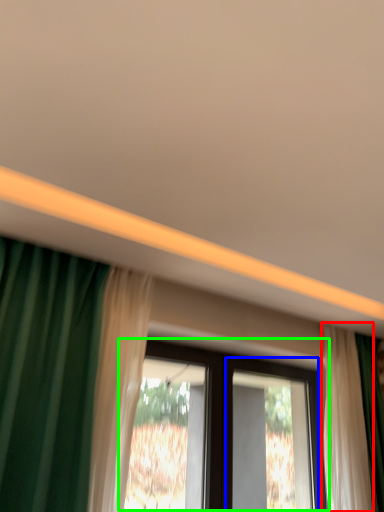
Question: Which is farther away from curtain (highlighted by a red box)? screen door (highlighted by a blue box) or window (highlighted by a green box)?

Choices:
 (A) screen door
 (B) window

Answer: (A)